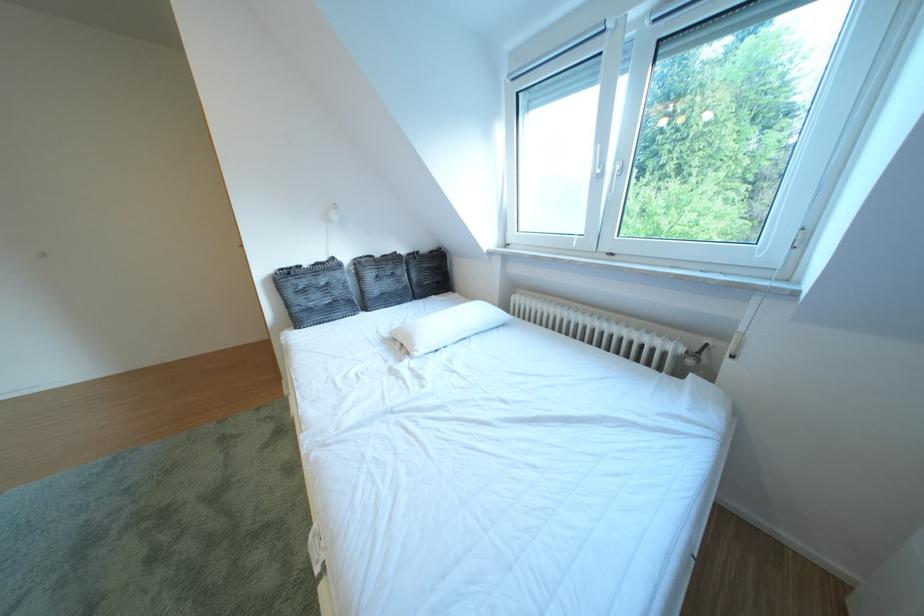
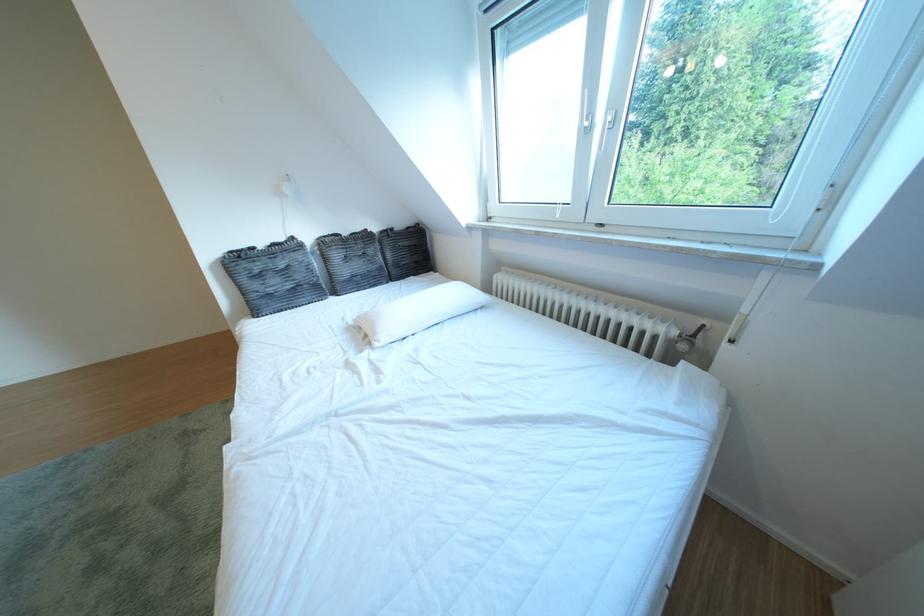
Which direction would the cameraman need to move to produce the second image?

The movement direction of the cameraman is right, forward.